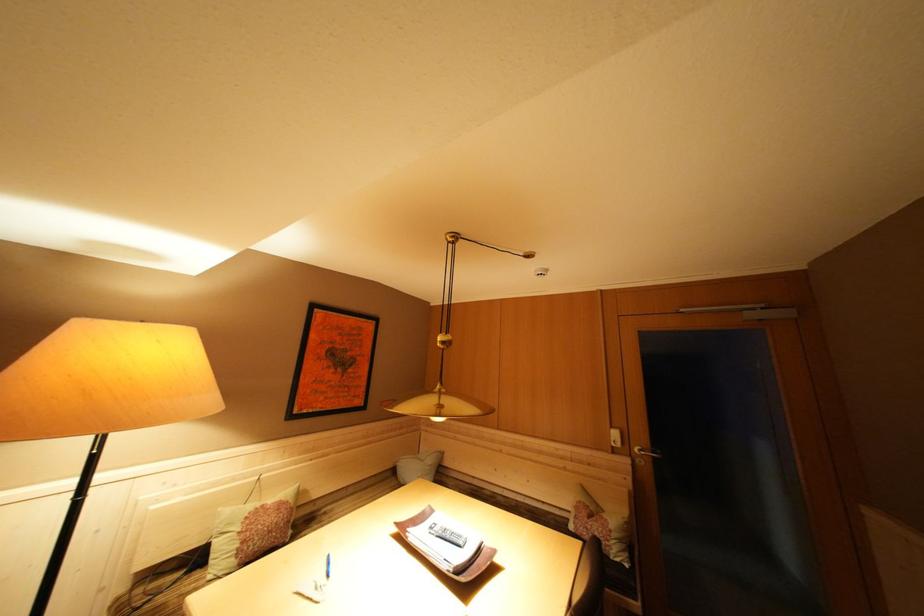
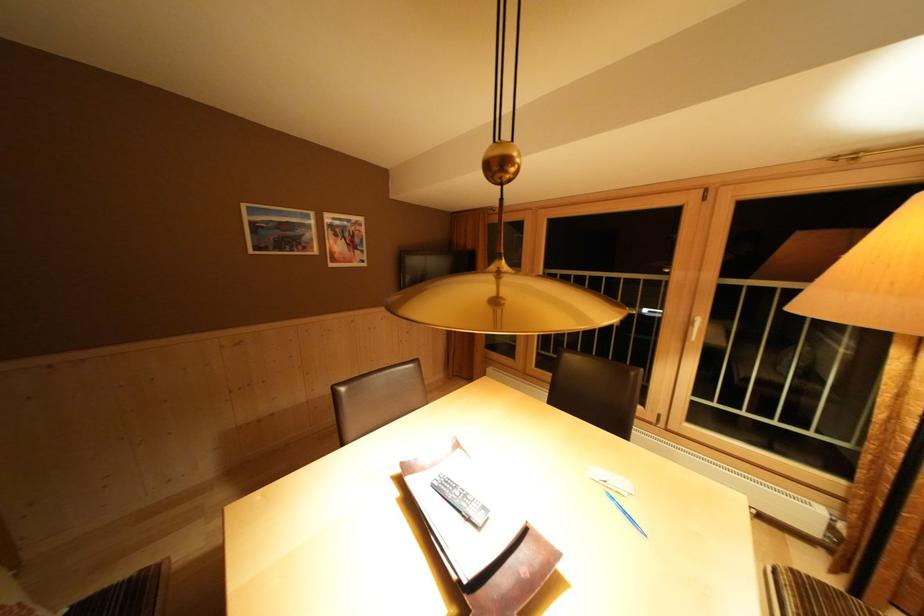
Find the pixel in the second image that matches point 335,569 in the first image.

(633, 517)